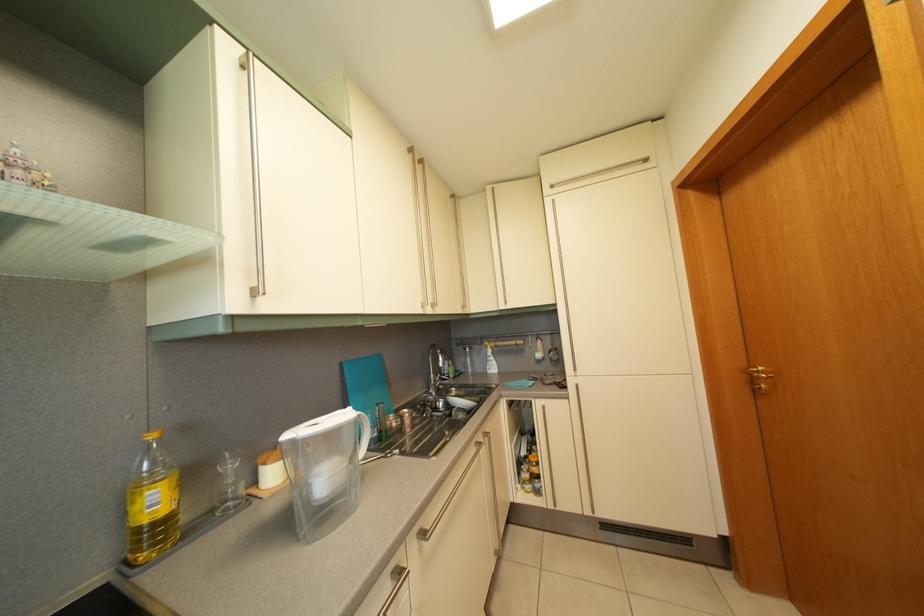
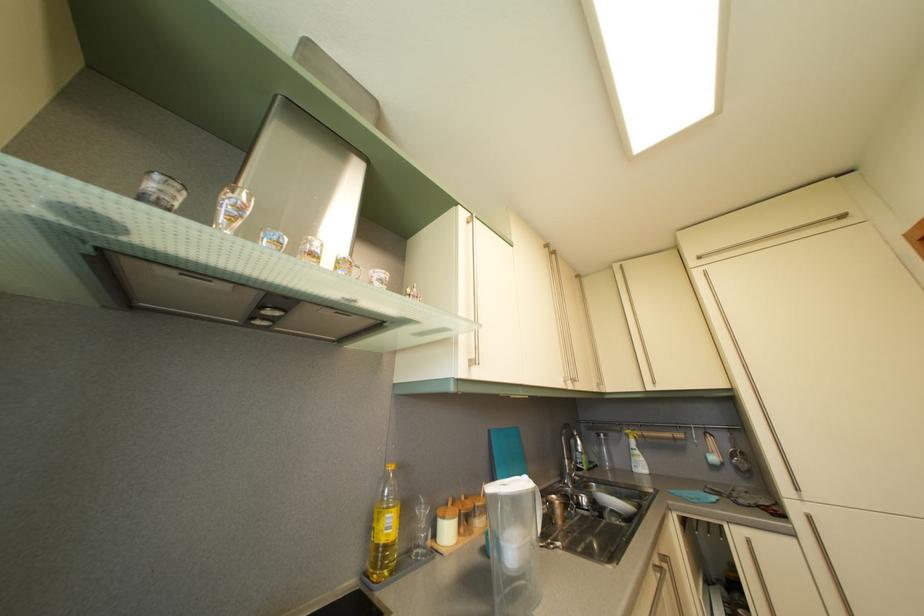
Where in the second image is the point corresponding to (x=334, y=485) from the first image?

(521, 554)